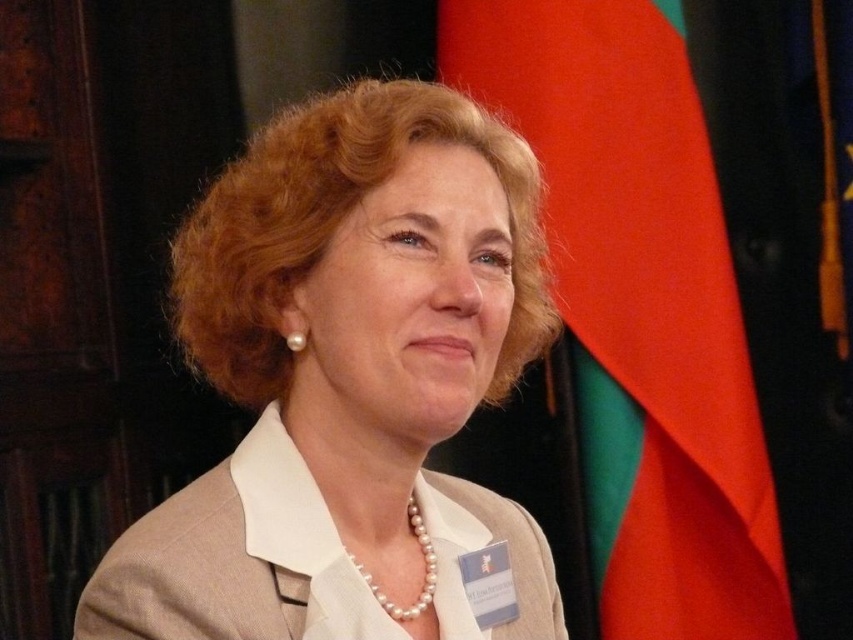
Which is below, red fabric flag at right or pearl necklace at center?

Positioned lower is pearl necklace at center.

Image resolution: width=853 pixels, height=640 pixels. What do you see at coordinates (640, 308) in the screenshot?
I see `red fabric flag at right` at bounding box center [640, 308].

In order to click on red fabric flag at right in this screenshot , I will do `click(640, 308)`.

Is matte beige suit at center thinner than red fabric flag at right?

Correct, matte beige suit at center's width is less than red fabric flag at right's.

Is matte beige suit at center smaller than red fabric flag at right?

Indeed, matte beige suit at center has a smaller size compared to red fabric flag at right.

Between point (558, 618) and point (590, 259), which one is positioned behind?

Positioned behind is point (590, 259).

You are a GUI agent. You are given a task and a screenshot of the screen. Output one action in this format:
    pyautogui.click(x=<x>, y=<y>)
    Task: Click on the matte beige suit at center
    The image size is (853, 640).
    Given the screenshot: What is the action you would take?
    click(347, 380)

Is matte beige suit at center positioned behind pearl necklace at center?

No, it is in front of pearl necklace at center.

At what (x,y) coordinates should I click in order to perform the action: click on matte beige suit at center. Please return your answer as a coordinate pair (x, y). The width and height of the screenshot is (853, 640). Looking at the image, I should click on (347, 380).